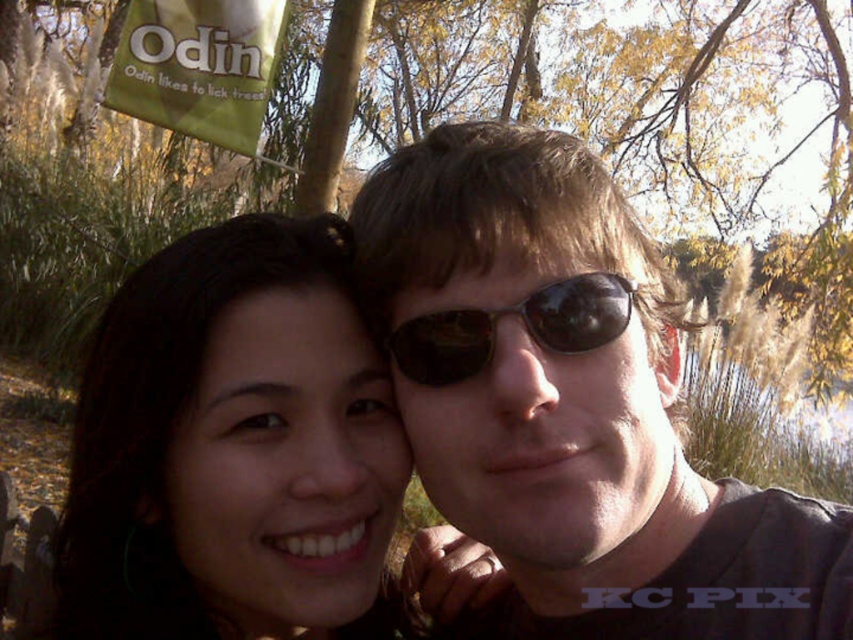
You are taking a photo of two friends in an autumn setting. You notice two points marked in the image. Which point is closer to you, point (479, 417) or point (535, 292)?

Point (479, 417) is closer to you because it is further to the viewer than point (535, 292).

In the scene shown: You are holding a 36 inch long pole and want to touch the point at coordinates point (387, 339) in the image. Can you reach it with the pole?

The point (387, 339) is 32.93 inches away from viewer, so no, the pole is longer than needed but since it is 36 inches long, you can reach it by extending the pole fully.

Looking at this image, based on the scene description, where is the dark brown hair at center located in terms of coordinates?

The dark brown hair at center is located at coordinates point (233, 448).